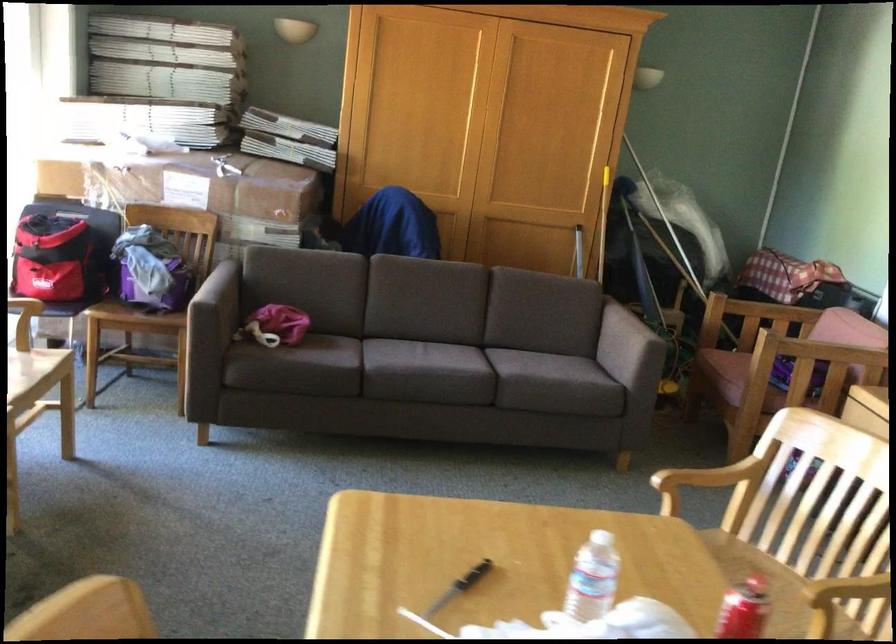
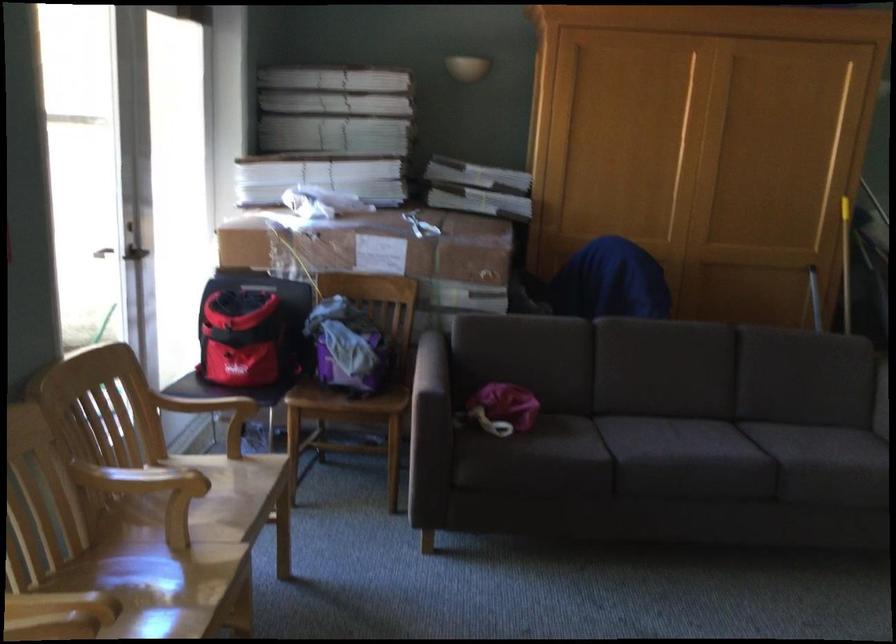
Find the pixel in the second image that matches point 178,185 in the first image.

(371, 245)